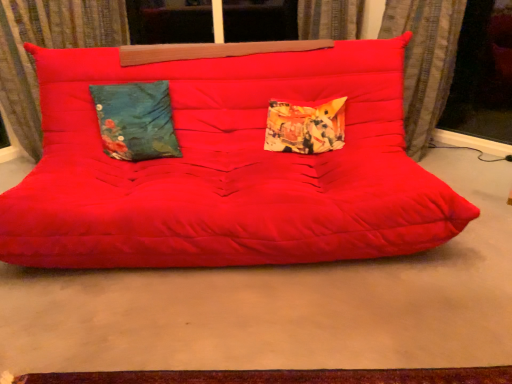
Question: In terms of size, does matte red futon at center appear bigger or smaller than teal floral fabric pillow at left, acting as the second pillow starting from the right?

Choices:
 (A) small
 (B) big

Answer: (B)

Question: Based on their positions, is matte red futon at center located to the left or right of teal floral fabric pillow at left, acting as the second pillow starting from the right?

Choices:
 (A) left
 (B) right

Answer: (B)

Question: Estimate the real-world distances between objects in this image. Which object is farther from the velvet curtain at upper left, the 1th curtain when ordered from left to right?

Choices:
 (A) textured fabric curtain at right, the first curtain in the right-to-left sequence
 (B) matte red futon at center
 (C) matte red studio couch at center
 (D) transparent glass window screen at right
 (E) printed fabric pillow at center, which appears as the 1th pillow when viewed from the right

Answer: (D)

Question: Which object is the farthest from the matte red studio couch at center?

Choices:
 (A) transparent glass window screen at right
 (B) textured fabric curtain at right, the first curtain in the right-to-left sequence
 (C) teal floral fabric pillow at left, acting as the second pillow starting from the right
 (D) velvet curtain at upper left, placed as the 2th curtain when sorted from right to left
 (E) printed fabric pillow at center, which ranks as the 2th pillow in left-to-right order

Answer: (A)